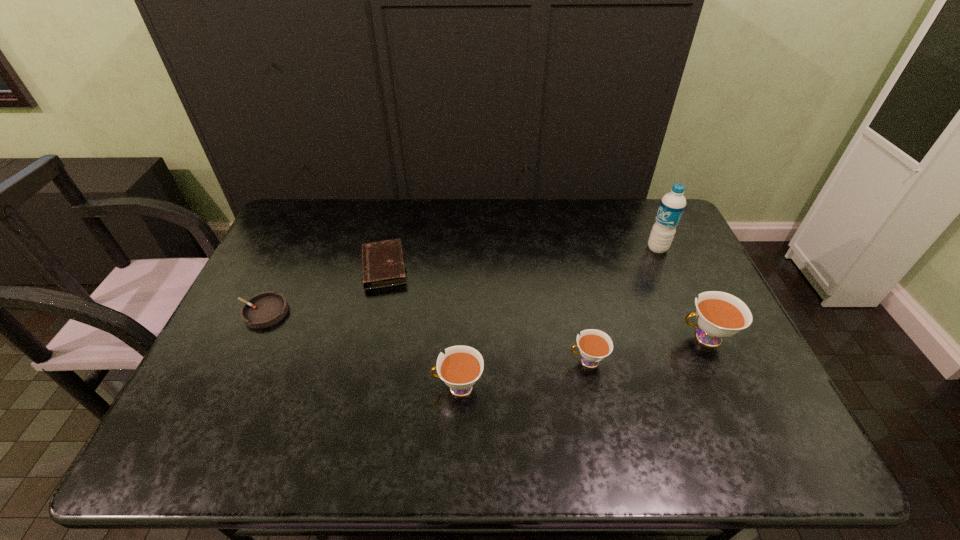
The height and width of the screenshot is (540, 960). What are the coordinates of `the fourth object from right to left` in the screenshot? It's located at (460, 368).

This screenshot has width=960, height=540. Identify the location of the second shortest teacup. (460, 368).

I want to click on the second teacup from right to left, so click(x=594, y=345).

I want to click on the third object from right to left, so click(x=594, y=345).

The image size is (960, 540). Find the location of `the tallest teacup`. the tallest teacup is located at coordinates tap(719, 315).

Where is `the fifth shortest object`? The image size is (960, 540). the fifth shortest object is located at coordinates (719, 315).

Identify the location of the fifth object from right to left. (383, 265).

The height and width of the screenshot is (540, 960). I want to click on the leftmost object, so click(265, 309).

Find the location of a particular element. water bottle is located at coordinates (672, 205).

Where is `free space located on the side of the second shortest teacup with the handle`? The width and height of the screenshot is (960, 540). free space located on the side of the second shortest teacup with the handle is located at coordinates (399, 387).